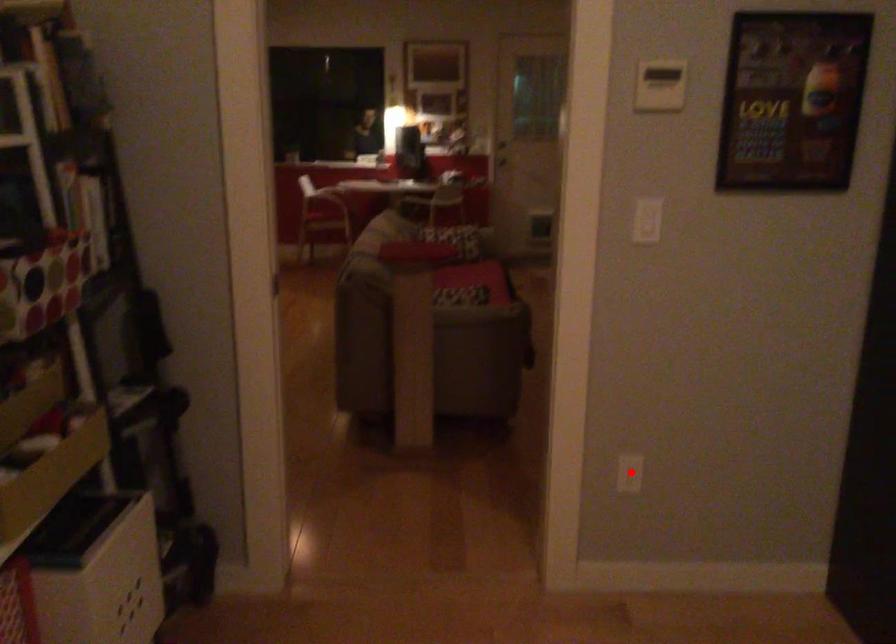
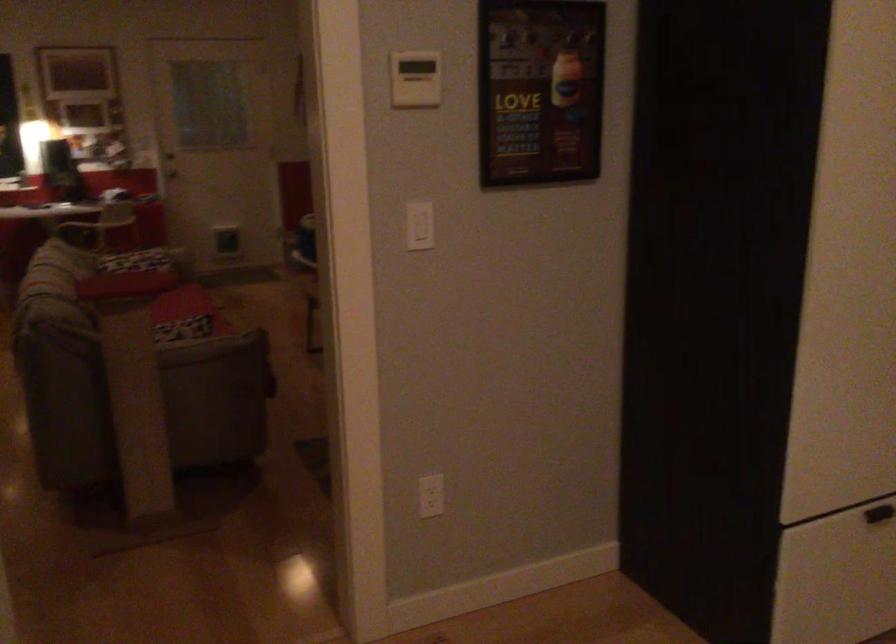
In the second image, find the point that corresponds to the highlighted location in the first image.

(431, 496)